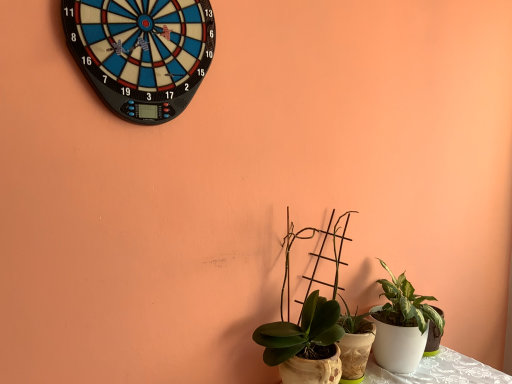
Question: In terms of height, does blue plastic dartboard at upper left look taller or shorter compared to green matte plant at center, which is the second houseplant in right-to-left order?

Choices:
 (A) short
 (B) tall

Answer: (A)

Question: Relative to green matte plant at center, the 1th houseplant from the left, is blue plastic dartboard at upper left in front or behind?

Choices:
 (A) front
 (B) behind

Answer: (A)

Question: Which object is positioned closest to the white glossy pot at lower right, which appears as the 1th houseplant when viewed from the right?

Choices:
 (A) blue plastic dartboard at upper left
 (B) green matte plant at center, which is the second houseplant in right-to-left order

Answer: (B)

Question: Which is nearer to the blue plastic dartboard at upper left?

Choices:
 (A) white glossy pot at lower right, the 2th houseplant in the left-to-right sequence
 (B) green matte plant at center, the 1th houseplant from the left

Answer: (B)